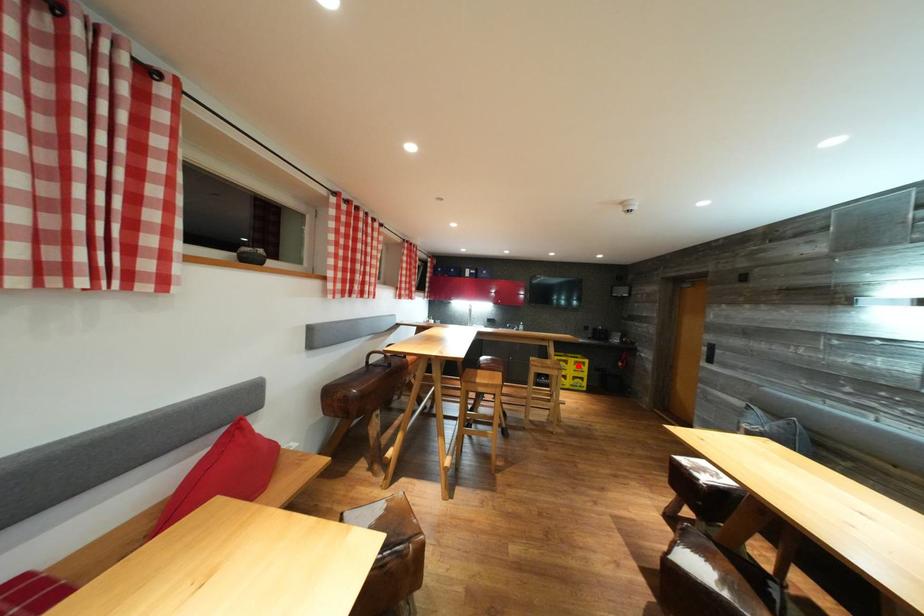
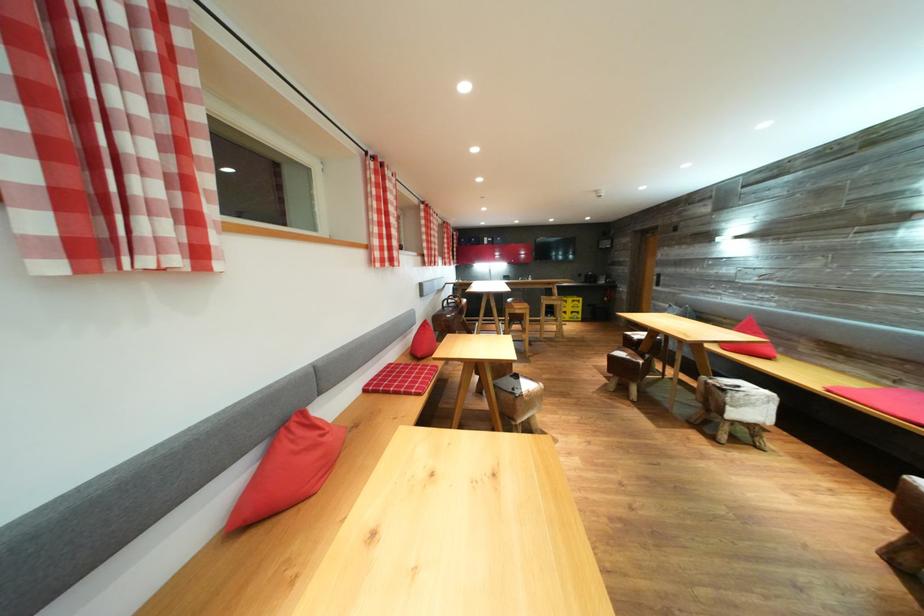
Find the pixel in the second image that matches the highlighted location in the first image.

(577, 305)